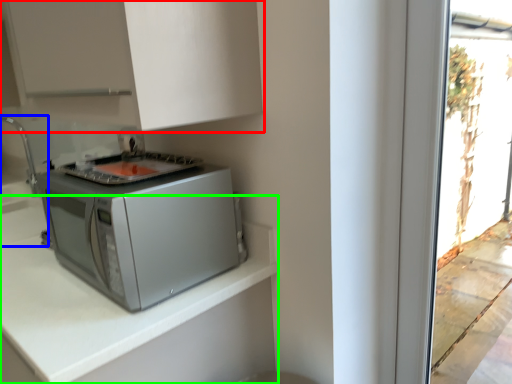
Question: Based on their relative distances, which object is farther from cabinetry (highlighted by a red box)? Choose from sink (highlighted by a blue box) and countertop (highlighted by a green box).

Choices:
 (A) sink
 (B) countertop

Answer: (A)